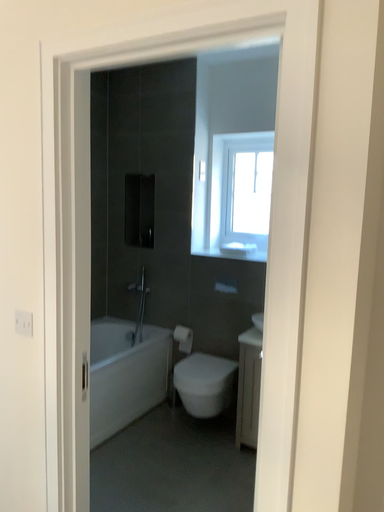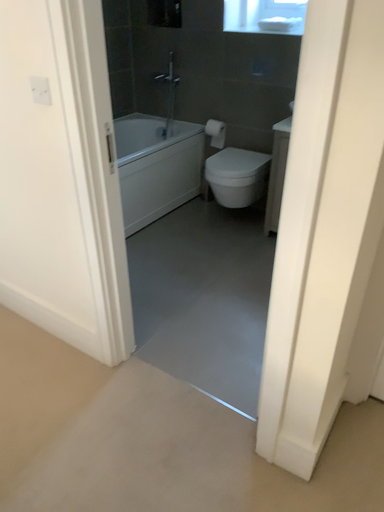
Question: Which way did the camera rotate in the video?

Choices:
 (A) rotated upward
 (B) rotated downward

Answer: (B)